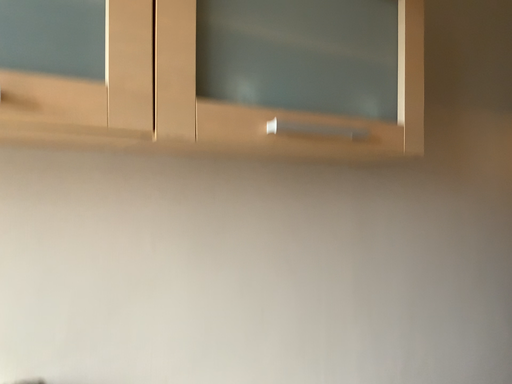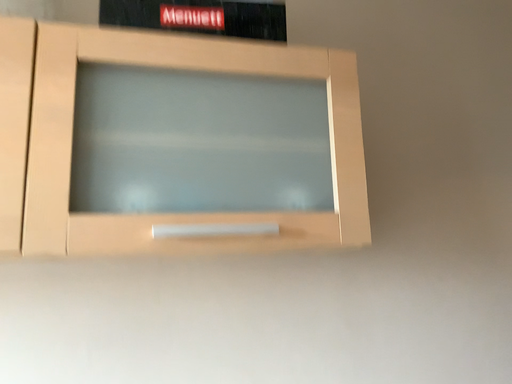
Question: How did the camera likely rotate when shooting the video?

Choices:
 (A) rotated upward
 (B) rotated downward

Answer: (A)